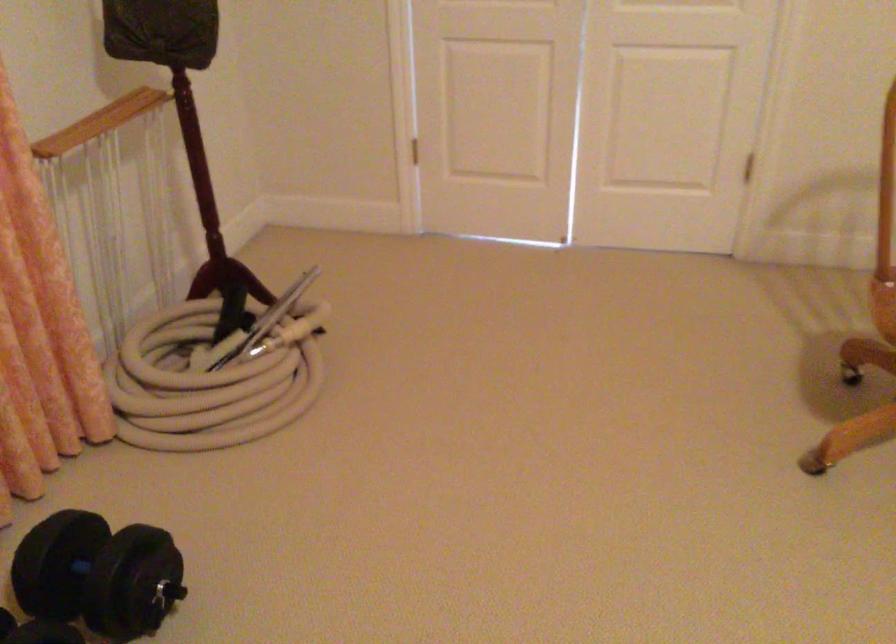
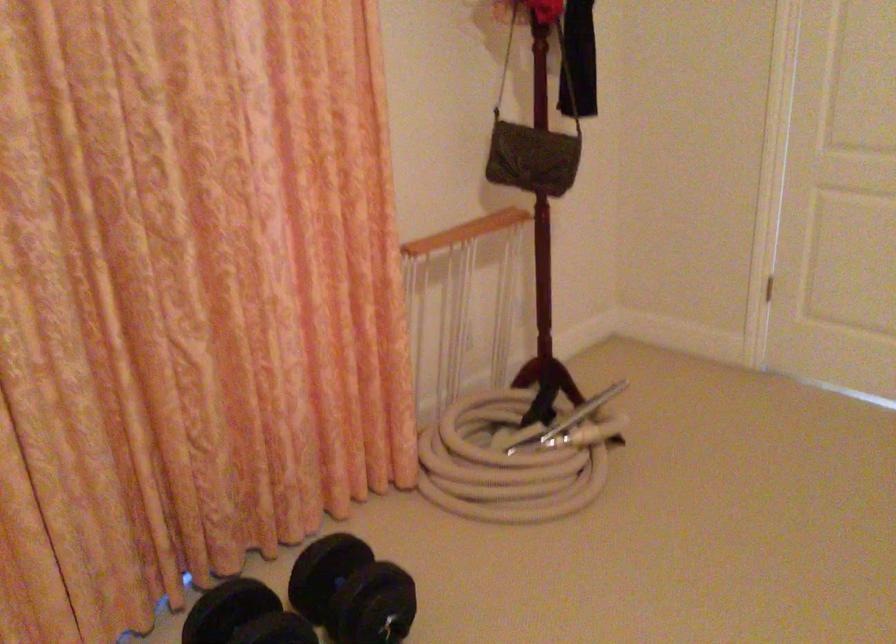
In the second image, find the point that corresponds to the point at 440,165 in the first image.

(762, 283)